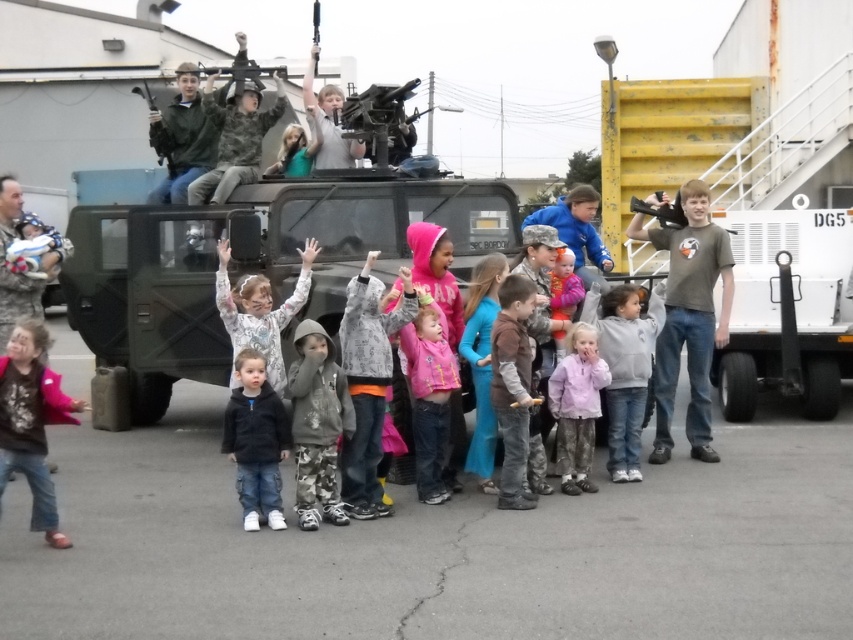
Question: Where is gray matte t-shirt at center located in relation to brown matte shirt at lower left in the image?

Choices:
 (A) below
 (B) above

Answer: (B)

Question: Among these points, which one is nearest to the camera?

Choices:
 (A) (711, 445)
 (B) (579, 228)

Answer: (B)

Question: Which object appears farthest from the camera in this image?

Choices:
 (A) gray matte t-shirt at center
 (B) pink fleece jacket at center

Answer: (A)

Question: Can you confirm if brown denim jeans at center is positioned to the right of pink matte jacket at center?

Choices:
 (A) yes
 (B) no

Answer: (B)

Question: Is gray fleece jacket at center wider than fluffy pink sweater at center?

Choices:
 (A) yes
 (B) no

Answer: (A)

Question: Which object is closer to the camera taking this photo?

Choices:
 (A) fluffy pink sweater at center
 (B) matte black rifle at upper center
 (C) light pink hoodie at center

Answer: (C)